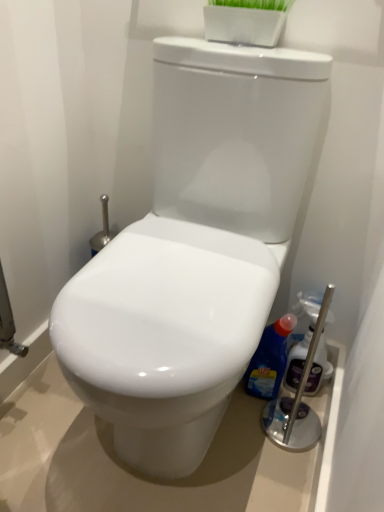
Where is `free spot to the left of translucent plastic spray bottle at right, the second cleaning product in the left-to-right sequence`? free spot to the left of translucent plastic spray bottle at right, the second cleaning product in the left-to-right sequence is located at coordinates (247, 411).